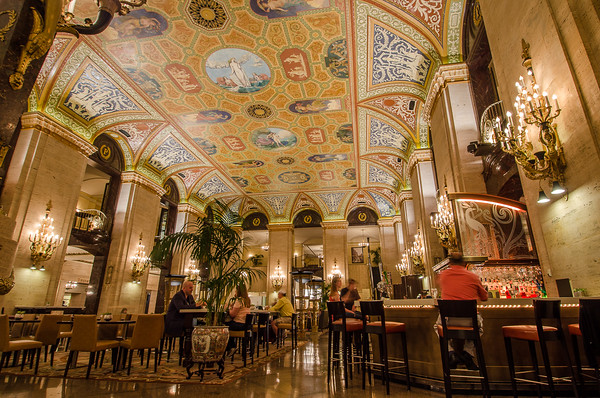
You are a GUI agent. You are given a task and a screenshot of the screen. Output one action in this format:
    pyautogui.click(x=<x>, y=<y>)
    Task: Click on the floor
    This screenshot has height=398, width=600.
    Given the screenshot: What is the action you would take?
    pyautogui.click(x=296, y=366)